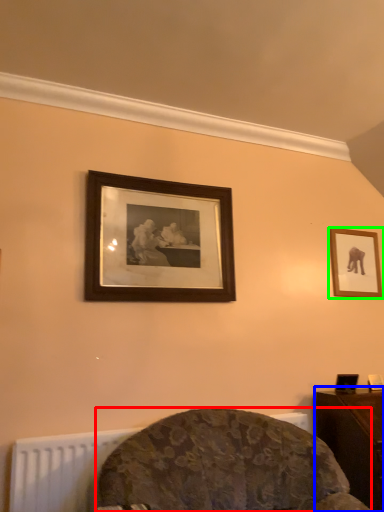
Question: Which is nearer to the furniture (highlighted by a red box)? table (highlighted by a blue box) or picture frame (highlighted by a green box).

Choices:
 (A) table
 (B) picture frame

Answer: (A)